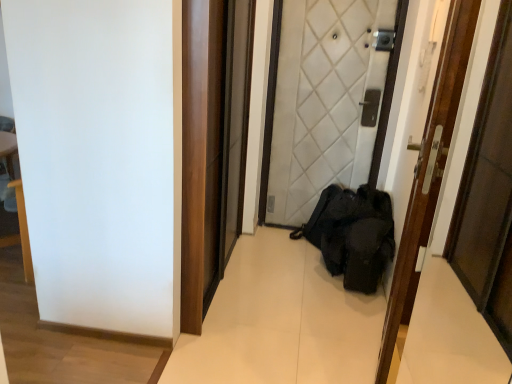
This screenshot has width=512, height=384. I want to click on vacant space positioned to the left of white quilted fabric door at center, which is the second door from front to back, so click(x=266, y=243).